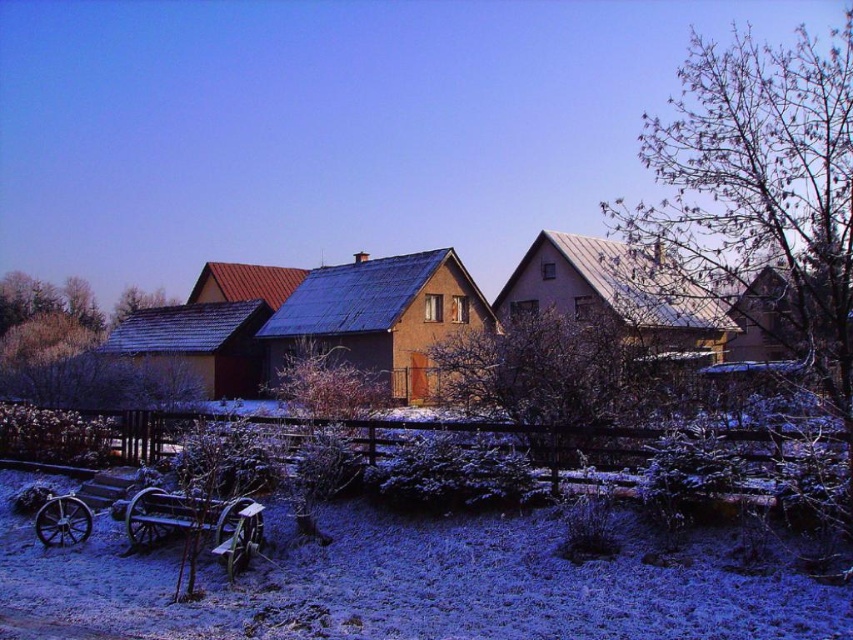
Question: Can you confirm if metallic gray house at center is smaller than wooden wagon at lower left?

Choices:
 (A) no
 (B) yes

Answer: (A)

Question: Which point appears farthest from the camera in this image?

Choices:
 (A) (268, 291)
 (B) (329, 353)
 (C) (596, 243)
 (D) (136, 298)

Answer: (D)

Question: Where is brown textured house at center located in relation to wooden wagon at lower left in the image?

Choices:
 (A) below
 (B) above

Answer: (B)

Question: Is brown textured house at center further to camera compared to wooden wagon at lower left?

Choices:
 (A) yes
 (B) no

Answer: (A)

Question: Among these objects, which one is farthest from the camera?

Choices:
 (A) bare wood tree at upper right
 (B) green leafy tree at upper left
 (C) brown textured tree at center

Answer: (B)

Question: Based on their relative distances, which object is nearer to the green leafy tree at upper left?

Choices:
 (A) bare wood tree at upper right
 (B) brown textured tree at center
 (C) bare branches at center

Answer: (B)